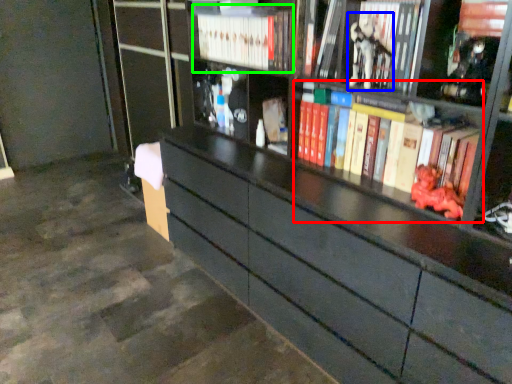
Question: Based on their relative distances, which object is nearer to book (highlighted by a red box)? Choose from toy (highlighted by a blue box) and book (highlighted by a green box).

Choices:
 (A) toy
 (B) book

Answer: (A)